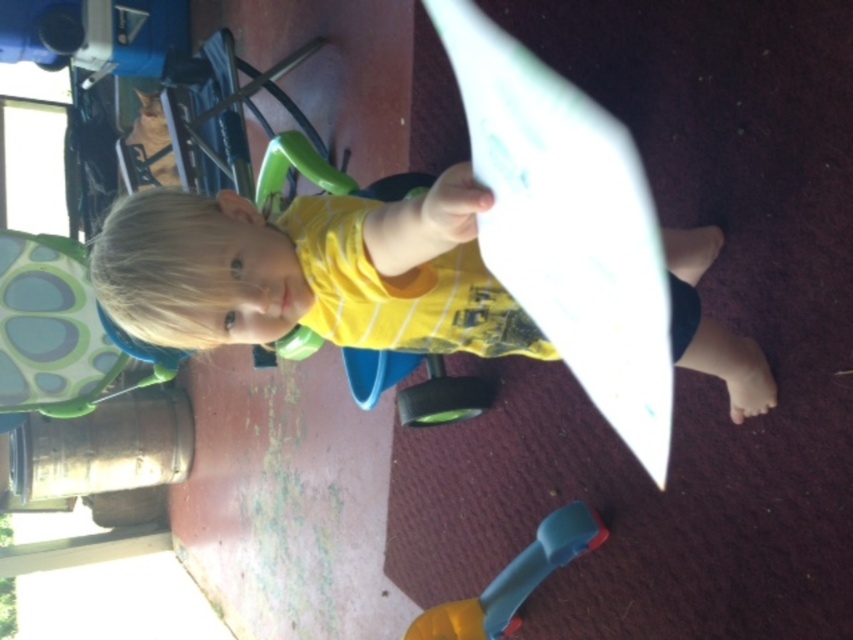
You are a photographer trying to capture the blue plastic toy at lower center in the image. To ensure the yellow cotton shirt at center doesn not block the view, should you move to the right or left of the child?

The yellow cotton shirt at center is positioned on the left side of the blue plastic toy at lower center. To avoid blocking the view, move to the right side of the child so the shirt is out of the way.

You are a photographer standing in front of the yellow cotton shirt at center. You want to take a closeup shot without moving the shirt. What is the minimum distance you need to move forward to get the shirt into focus?

The minimum distance you need to move forward is 79.46 centimeters to get the yellow cotton shirt at center into focus.